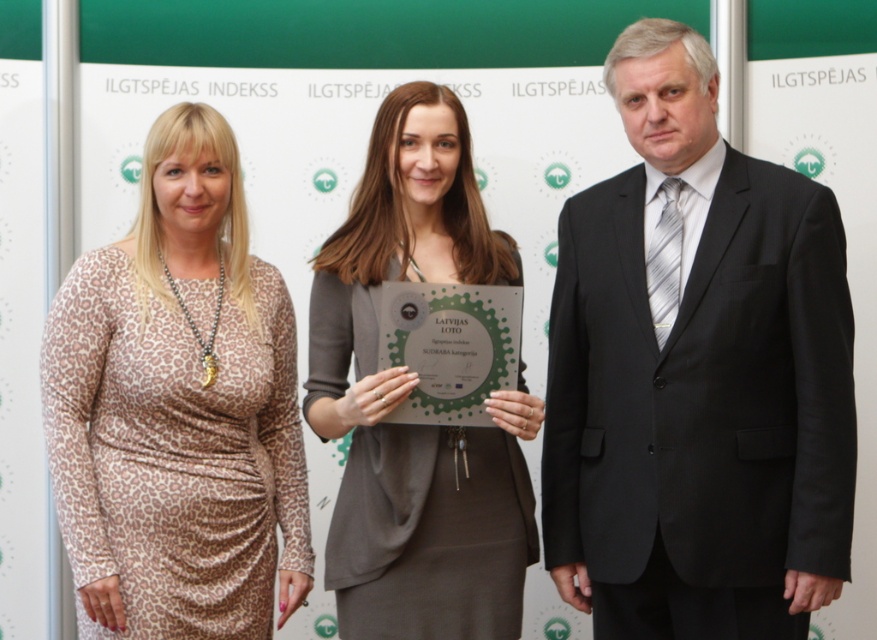
Between point (811, 589) and point (118, 243), which one is positioned behind?

Positioned behind is point (118, 243).

Does point (633, 300) lie in front of point (41, 400)?

No, it is behind (41, 400).

Where is `black suit at right`? This screenshot has width=877, height=640. black suit at right is located at coordinates (696, 374).

Is point (622, 214) positioned before point (376, 596)?

No, (622, 214) is behind (376, 596).

Who is higher up, black suit at right or matte gray dress at center?

black suit at right is above.

Does point (832, 355) come in front of point (359, 209)?

That is True.

Where is `black suit at right`? The width and height of the screenshot is (877, 640). black suit at right is located at coordinates (696, 374).

Is leopard print dress at left further to the viewer compared to matte gray dress at center?

No, leopard print dress at left is closer to the viewer.

Is point (136, 387) behind point (365, 193)?

No, (136, 387) is closer to viewer.

What do you see at coordinates (177, 408) in the screenshot? I see `leopard print dress at left` at bounding box center [177, 408].

The width and height of the screenshot is (877, 640). In order to click on leopard print dress at left in this screenshot , I will do `click(177, 408)`.